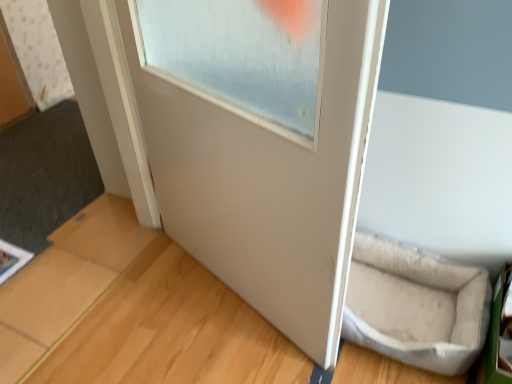
Question: Is white matte door frame at upper left inside or outside of light brown wood at lower right?

Choices:
 (A) inside
 (B) outside

Answer: (B)

Question: From a real-world perspective, relative to light brown wood at lower right, is white matte door frame at upper left vertically above or below?

Choices:
 (A) below
 (B) above

Answer: (B)

Question: Which object is the farthest from the white matte door frame at upper left?

Choices:
 (A) light brown wood at lower right
 (B) white matte door at center
 (C) beige fabric pet bed at lower right

Answer: (C)

Question: Which of these objects is positioned closest to the beige fabric pet bed at lower right?

Choices:
 (A) light brown wood at lower right
 (B) white matte door frame at upper left
 (C) white matte door at center

Answer: (A)